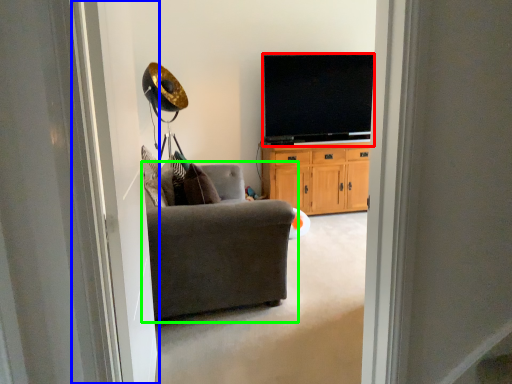
Question: Which object is positioned farthest from television (highlighted by a red box)? Select from screen door (highlighted by a blue box) and chair (highlighted by a green box).

Choices:
 (A) screen door
 (B) chair

Answer: (A)